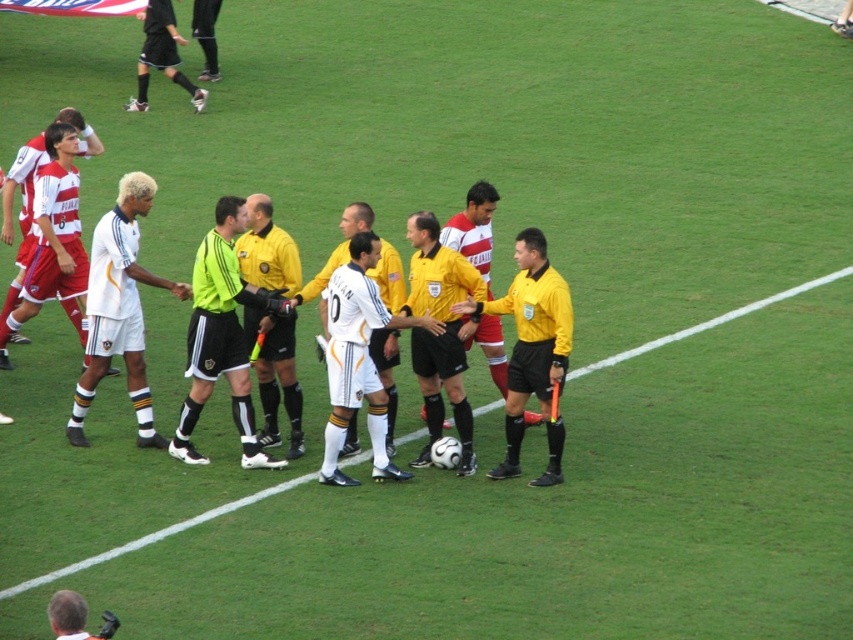
You are a photographer positioned at the edge of the soccer field. You want to take a photo of the white matte soccer player at center and the yellow jersey at center. Which one will appear closer to you in the photo?

The white matte soccer player at center will appear closer to you in the photo because it is positioned further to the viewer than the yellow jersey at center.

You are a soccer coach observing the field. You notice the white matte soccer ball at center and the black jersey at center. Which object is positioned lower on the field?

The white matte soccer ball at center is positioned below the black jersey at center, so it is lower on the field.